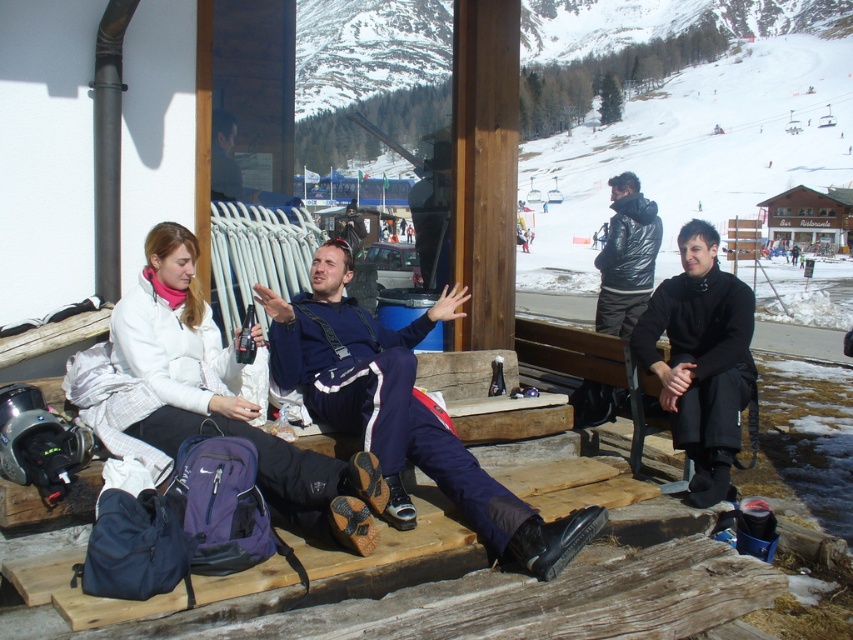
Question: Which of these objects is positioned farthest from the white fleece jacket at left?

Choices:
 (A) black matte jacket at right
 (B) navy blue ski suit at center

Answer: (A)

Question: Estimate the real-world distances between objects in this image. Which object is closer to the white fleece jacket at left?

Choices:
 (A) black leather jacket at right
 (B) black matte jacket at right
 (C) navy blue ski suit at center

Answer: (C)

Question: Which of the following is the farthest from the observer?

Choices:
 (A) white fleece jacket at left
 (B) navy blue ski suit at center
 (C) black matte jacket at right

Answer: (C)

Question: Is black matte jacket at right wider than black leather jacket at right?

Choices:
 (A) no
 (B) yes

Answer: (A)

Question: Is navy blue ski suit at center wider than black matte jacket at right?

Choices:
 (A) no
 (B) yes

Answer: (B)

Question: Is navy blue ski suit at center above white fleece jacket at left?

Choices:
 (A) yes
 (B) no

Answer: (A)